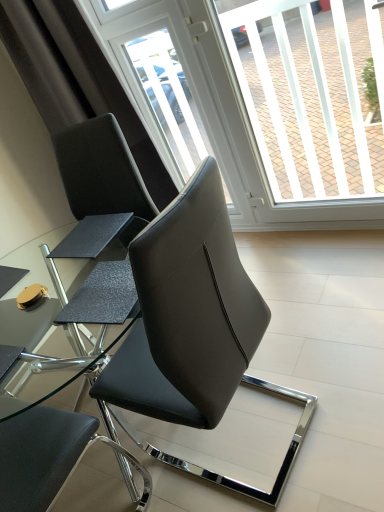
Question: Do you think matte black chair at center, marked as the third chair in a front-to-back arrangement, is within black leather chair at center, which is the 2th chair in front-to-back order, or outside of it?

Choices:
 (A) outside
 (B) inside

Answer: (A)

Question: From a real-world perspective, is matte black chair at center, the 1th chair positioned from the back, positioned above or below black leather chair at center, which is the 2th chair in front-to-back order?

Choices:
 (A) above
 (B) below

Answer: (A)

Question: Estimate the real-world distances between objects in this image. Which object is farther from the transparent plastic screen door at upper center?

Choices:
 (A) black leather chair at center, which is the 2th chair in front-to-back order
 (B) transparent glass window screen at upper center
 (C) black leather chair at center, which is the third chair in back-to-front order
 (D) matte black chair at center, marked as the third chair in a front-to-back arrangement

Answer: (A)

Question: Based on their relative distances, which object is nearer to the matte black chair at center, the 1th chair positioned from the back?

Choices:
 (A) black leather chair at center, which is the third chair in back-to-front order
 (B) black leather chair at center, the 2th chair in the back-to-front sequence
 (C) transparent plastic screen door at upper center
 (D) transparent glass window screen at upper center

Answer: (A)